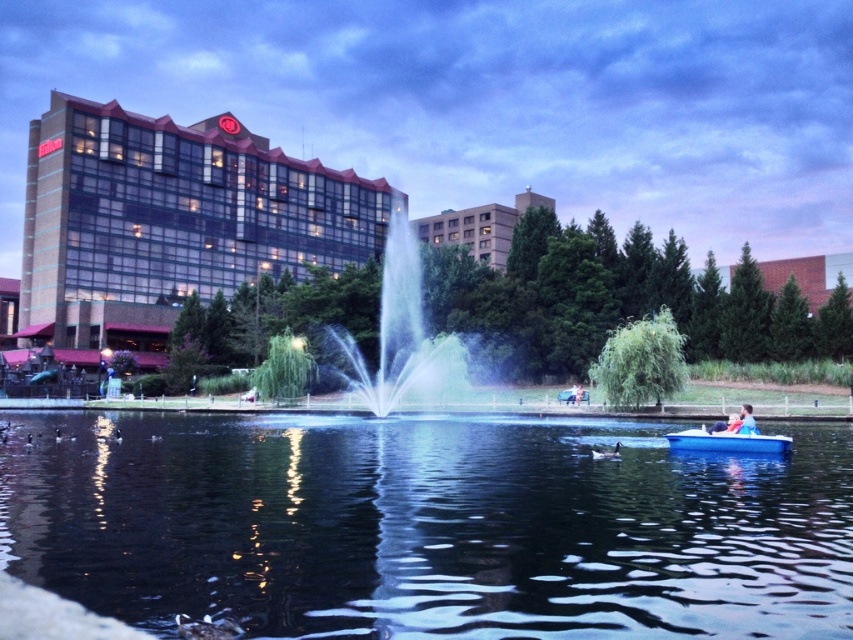
Question: Does blue translucent water at center appear over blue fabric person at center?

Choices:
 (A) no
 (B) yes

Answer: (B)

Question: Which of these objects is positioned farthest from the transparent water at center?

Choices:
 (A) blue fabric person at center
 (B) blue translucent water at center
 (C) brick/concrete hotel at left
 (D) beige concrete building at center

Answer: (C)

Question: Which object is the closest to the brick/concrete hotel at left?

Choices:
 (A) beige concrete building at center
 (B) blue fabric person at center
 (C) transparent water at center
 (D) white plastic boat at lower right

Answer: (A)

Question: Can you confirm if blue translucent water at center is smaller than beige concrete building at center?

Choices:
 (A) no
 (B) yes

Answer: (B)

Question: Is blue translucent water at center wider than white plastic boat at lower right?

Choices:
 (A) yes
 (B) no

Answer: (A)

Question: Which of the following is the closest to the observer?

Choices:
 (A) transparent water at center
 (B) brick/concrete hotel at left

Answer: (A)